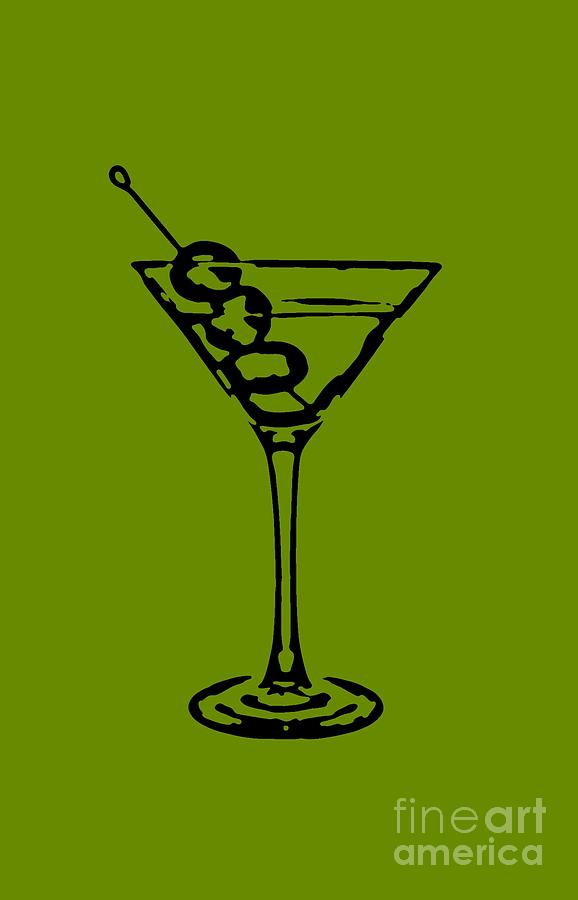
The width and height of the screenshot is (578, 900). I want to click on martini glass, so click(x=272, y=664).